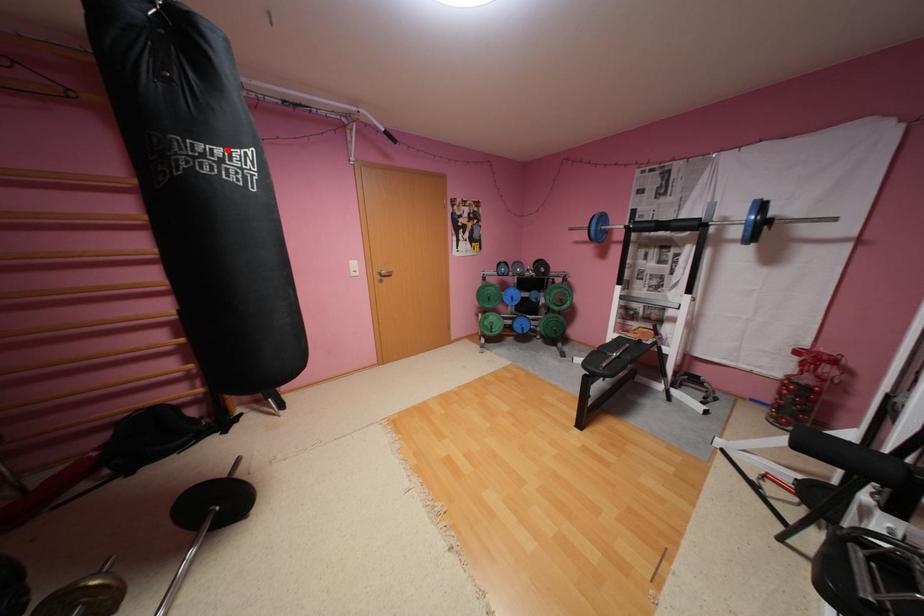
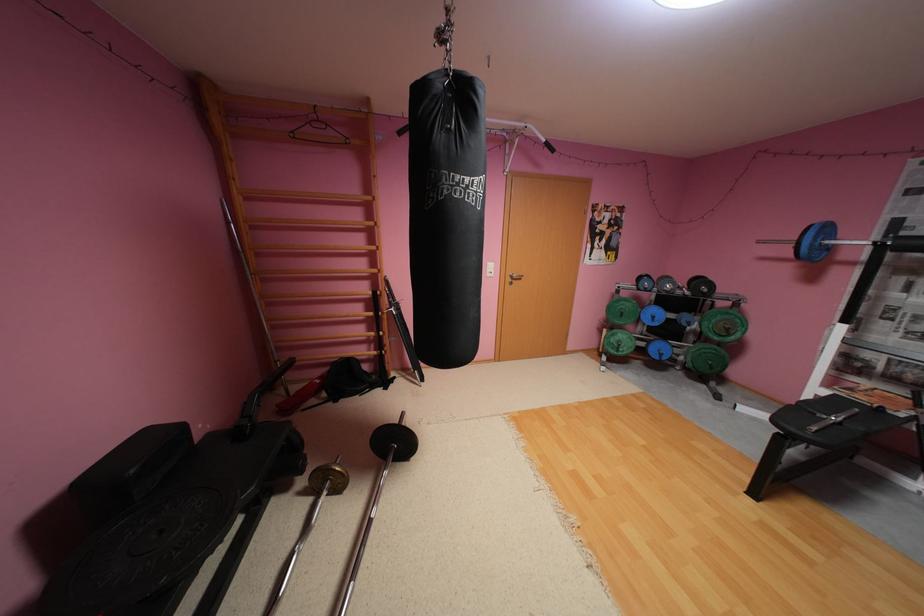
Find the pixel in the second image that matches the highlighted location in the first image.

(477, 179)